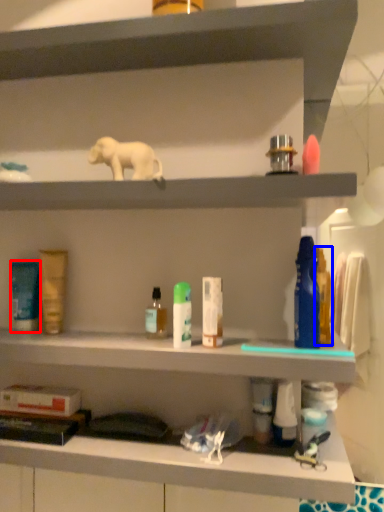
Question: Which of the following is the closest to the observer, toiletry (highlighted by a red box) or toiletry (highlighted by a blue box)?

Choices:
 (A) toiletry
 (B) toiletry

Answer: (B)